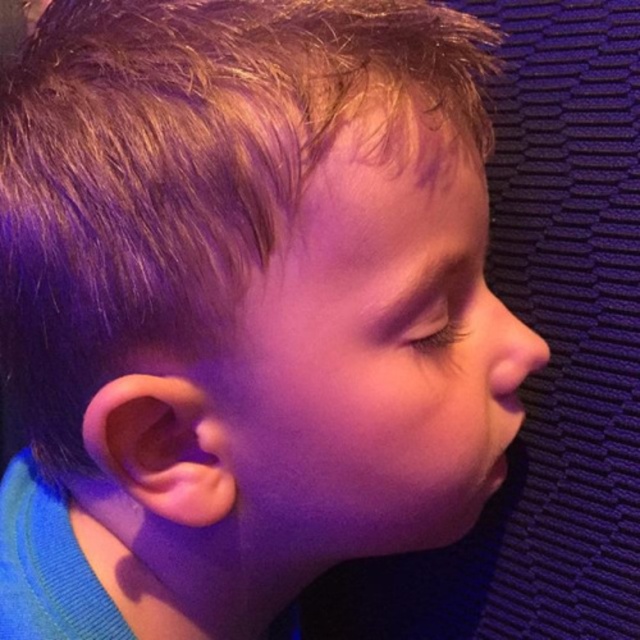
Is blonde smooth hair at upper left taller than smooth skin face at center?

Yes, blonde smooth hair at upper left is taller than smooth skin face at center.

Can you confirm if blonde smooth hair at upper left is wider than smooth skin face at center?

Answer: Yes.

Is point (19, 173) less distant than point (484, 305)?

Yes.

Locate an element on the screen. The height and width of the screenshot is (640, 640). blonde smooth hair at upper left is located at coordinates (180, 164).

Is blonde smooth hair at upper left above smooth flesh nose at center?

Yes, blonde smooth hair at upper left is above smooth flesh nose at center.

Can you confirm if blonde smooth hair at upper left is taller than smooth flesh nose at center?

Yes.

Find the location of `blonde smooth hair at upper left`. blonde smooth hair at upper left is located at coordinates (180, 164).

Where is `blonde smooth hair at upper left`? This screenshot has height=640, width=640. blonde smooth hair at upper left is located at coordinates (180, 164).

Is smooth skin face at center positioned behind shiny brown eye at center?

No, it is in front of shiny brown eye at center.

Is smooth skin face at center positioned before shiny brown eye at center?

That is True.

Which is behind, point (440, 385) or point (419, 348)?

The point (440, 385) is more distant.

In order to click on smooth skin face at center in this screenshot , I will do `click(364, 355)`.